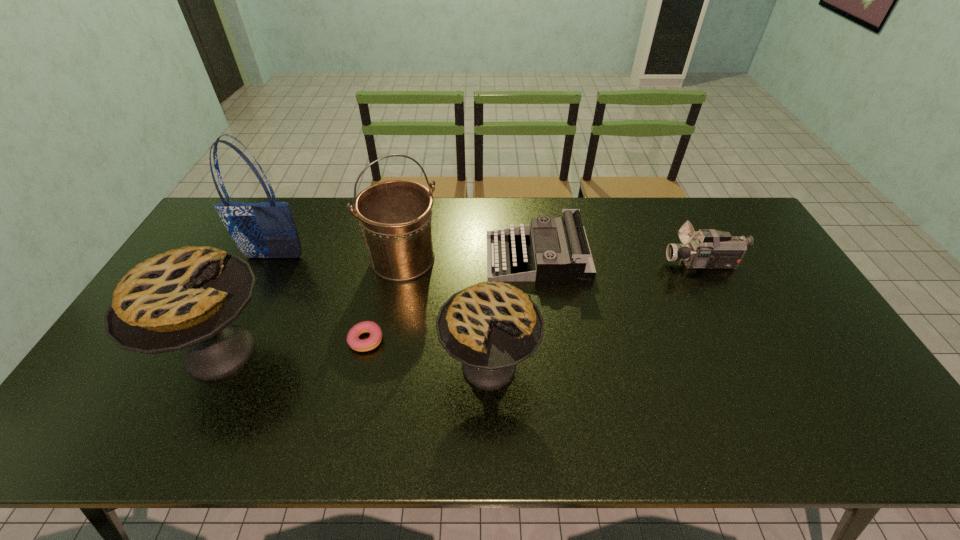
Identify the location of vacant point located on the cut side of the fifth shortest object. This screenshot has height=540, width=960. (322, 352).

I want to click on vacant space located 0.300m on the front-facing side of the shopping bag, so click(x=235, y=338).

Image resolution: width=960 pixels, height=540 pixels. Find the location of `free space located on the typing side of the typewriter`. free space located on the typing side of the typewriter is located at coordinates tap(410, 257).

What are the coordinates of `free space located on the typing side of the typewriter` in the screenshot? It's located at (397, 257).

Identify the location of vacant point located 0.230m on the typing side of the typewriter. This screenshot has width=960, height=540. (416, 257).

Where is `blank space located on the right of the bucket`? This screenshot has width=960, height=540. blank space located on the right of the bucket is located at coordinates (468, 260).

Image resolution: width=960 pixels, height=540 pixels. In order to click on vacant position located on the front-facing side of the camcorder in this screenshot , I will do `click(575, 264)`.

Identify the location of vacant position located 0.330m on the front-facing side of the camcorder. (562, 264).

You are a GUI agent. You are given a task and a screenshot of the screen. Output one action in this format:
    pyautogui.click(x=<x>, y=<y>)
    Task: Click on the free location located on the front-facing side of the camcorder
    Image resolution: width=960 pixels, height=540 pixels.
    Given the screenshot: What is the action you would take?
    pyautogui.click(x=647, y=264)

Identify the location of free spot located 0.270m on the left of the shortest object. The image size is (960, 540). (249, 340).